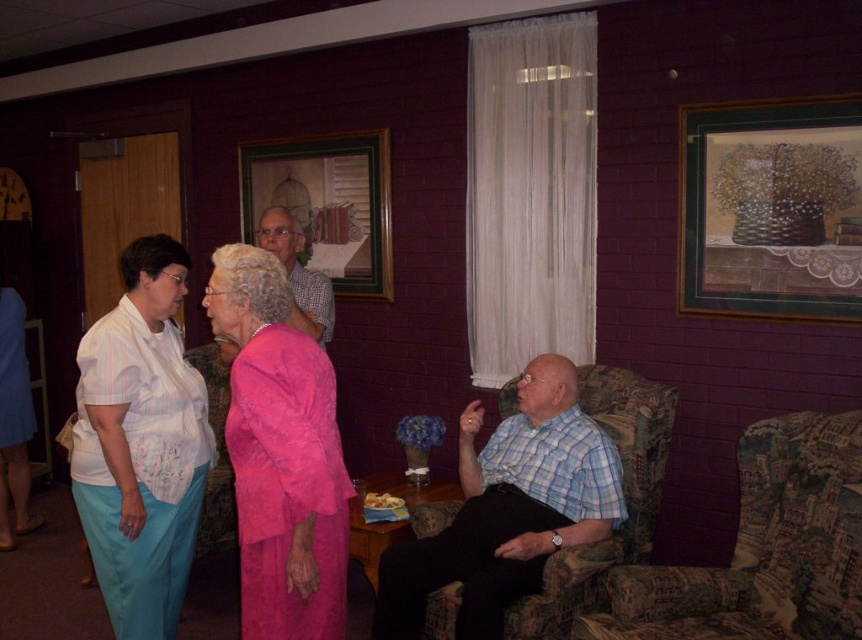
Question: Which point is farther from the camera taking this photo?

Choices:
 (A) (245, 257)
 (B) (820, 298)
 (C) (358, 260)
 (D) (307, 307)

Answer: (C)

Question: Can you confirm if matte white blouse at left is positioned below wooden frame at upper center?

Choices:
 (A) yes
 (B) no

Answer: (A)

Question: Among these objects, which one is nearest to the camera?

Choices:
 (A) blue plaid shirt at center
 (B) checkered fabric shirt at center

Answer: (A)

Question: In this image, where is patterned fabric armchair at right located relative to wooden frame at upper center?

Choices:
 (A) above
 (B) below

Answer: (B)

Question: Which object is the closest to the matte white blouse at left?

Choices:
 (A) wooden frame at upper center
 (B) checkered fabric shirt at center
 (C) pink satin dress at center
 (D) blue plaid shirt at center

Answer: (C)

Question: Does blue plaid shirt at center appear under checkered fabric shirt at center?

Choices:
 (A) no
 (B) yes

Answer: (B)